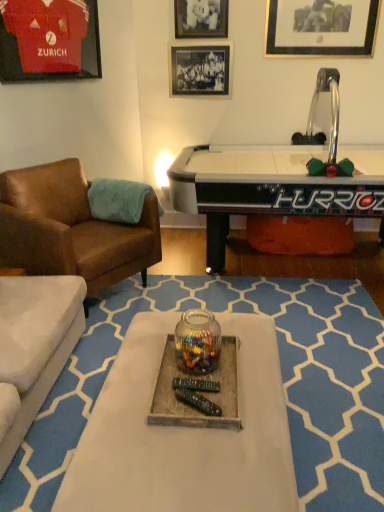
What is the approximate width of black matte picture frame at upper center, the first picture frame when ordered from right to left?

The width of black matte picture frame at upper center, the first picture frame when ordered from right to left, is 0.98 inches.

Locate an element on the screen. The height and width of the screenshot is (512, 384). matte jersey at upper left, which appears as the fourth picture frame when viewed from the right is located at coordinates (49, 40).

What do you see at coordinates (49, 40) in the screenshot? This screenshot has height=512, width=384. I see `matte jersey at upper left, placed as the first picture frame when sorted from left to right` at bounding box center [49, 40].

Identify the location of metallic silver picture frame at upper center, acting as the second picture frame starting from the right. This screenshot has width=384, height=512. (201, 18).

This screenshot has height=512, width=384. What are the coordinates of `brown leather chair at left` in the screenshot? It's located at (71, 229).

The image size is (384, 512). What do you see at coordinates (200, 68) in the screenshot?
I see `black matte picture frame at upper center, positioned as the 3th picture frame in right-to-left order` at bounding box center [200, 68].

What are the coordinates of `black plastic remote control at center, which is the first remote control in front-to-back order` in the screenshot? It's located at (197, 401).

Considering the relative sizes of metallic silver picture frame at upper center, positioned as the third picture frame in left-to-right order, and brown leather chair at left in the image provided, is metallic silver picture frame at upper center, positioned as the third picture frame in left-to-right order, wider than brown leather chair at left?

In fact, metallic silver picture frame at upper center, positioned as the third picture frame in left-to-right order, might be narrower than brown leather chair at left.

Could you tell me if metallic silver picture frame at upper center, positioned as the third picture frame in left-to-right order, is turned towards brown leather chair at left?

No, metallic silver picture frame at upper center, positioned as the third picture frame in left-to-right order, is not facing towards brown leather chair at left.

Is metallic silver picture frame at upper center, positioned as the third picture frame in left-to-right order, further to the viewer compared to brown leather chair at left?

Yes, it is behind brown leather chair at left.

Is white glossy air hockey table at center, arranged as the first table when viewed from the top, with matte jersey at upper left, which appears as the fourth picture frame when viewed from the right?

No, white glossy air hockey table at center, arranged as the first table when viewed from the top, is not in contact with matte jersey at upper left, which appears as the fourth picture frame when viewed from the right.

From the image's perspective, which object appears higher, white glossy air hockey table at center, arranged as the first table when viewed from the top, or matte jersey at upper left, which appears as the fourth picture frame when viewed from the right?

matte jersey at upper left, which appears as the fourth picture frame when viewed from the right, from the image's perspective.

Does white glossy air hockey table at center, the second table in the bottom-to-top sequence, lie behind matte jersey at upper left, placed as the first picture frame when sorted from left to right?

No.

Does point (297, 201) lie behind point (316, 53)?

That is False.

Which of these two, white glossy air hockey table at center, arranged as the first table when viewed from the top, or black matte picture frame at upper center, the first picture frame when ordered from right to left, is thinner?

With smaller width is black matte picture frame at upper center, the first picture frame when ordered from right to left.

In terms of size, does white glossy air hockey table at center, the second table in the bottom-to-top sequence, appear bigger or smaller than black matte picture frame at upper center, the first picture frame when ordered from right to left?

Considering their sizes, white glossy air hockey table at center, the second table in the bottom-to-top sequence, takes up more space than black matte picture frame at upper center, the first picture frame when ordered from right to left.

Considering the relative sizes of white glossy air hockey table at center, the second table in the bottom-to-top sequence, and black matte picture frame at upper center, the first picture frame when ordered from right to left, in the image provided, is white glossy air hockey table at center, the second table in the bottom-to-top sequence, shorter than black matte picture frame at upper center, the first picture frame when ordered from right to left,?

Incorrect, the height of white glossy air hockey table at center, the second table in the bottom-to-top sequence, does not fall short of that of black matte picture frame at upper center, the first picture frame when ordered from right to left.

Who is bigger, white wood tray at center, which ranks as the 1th table in bottom-to-top order, or matte jersey at upper left, which appears as the fourth picture frame when viewed from the right?

Bigger between the two is white wood tray at center, which ranks as the 1th table in bottom-to-top order.

Is white wood tray at center, which ranks as the 1th table in bottom-to-top order, positioned with its back to matte jersey at upper left, placed as the first picture frame when sorted from left to right?

No.

Is point (80, 495) farther from camera compared to point (2, 77)?

No, it is in front of (2, 77).

From a real-world perspective, is white wood tray at center, which is the second table in top-to-bottom order, above or below matte jersey at upper left, which appears as the fourth picture frame when viewed from the right?

Clearly, from a real-world perspective, white wood tray at center, which is the second table in top-to-bottom order, is below matte jersey at upper left, which appears as the fourth picture frame when viewed from the right.

Is black plastic remote control at center, arranged as the second remote control when viewed from the back, touching black matte picture frame at upper center, the first picture frame when ordered from right to left?

No, black plastic remote control at center, arranged as the second remote control when viewed from the back, is not with black matte picture frame at upper center, the first picture frame when ordered from right to left.

Is black plastic remote control at center, which is the first remote control in front-to-back order, looking in the opposite direction of black matte picture frame at upper center, which appears as the 4th picture frame when viewed from the left?

No, black plastic remote control at center, which is the first remote control in front-to-back order, is not facing away from black matte picture frame at upper center, which appears as the 4th picture frame when viewed from the left.

Does black plastic remote control at center, which is the first remote control in front-to-back order, appear on the right side of black matte picture frame at upper center, the first picture frame when ordered from right to left?

In fact, black plastic remote control at center, which is the first remote control in front-to-back order, is to the left of black matte picture frame at upper center, the first picture frame when ordered from right to left.

Is black matte picture frame at upper center, positioned as the 3th picture frame in right-to-left order, further to camera compared to black matte picture frame at upper center, which appears as the 4th picture frame when viewed from the left?

That is True.

Where is `picture frame that is the 2nd one when counting backward from the black matte picture frame at upper center, which appears as the 4th picture frame when viewed from the left`? The image size is (384, 512). picture frame that is the 2nd one when counting backward from the black matte picture frame at upper center, which appears as the 4th picture frame when viewed from the left is located at coordinates (200, 68).

From a real-world perspective, is black matte picture frame at upper center, positioned as the 2th picture frame in left-to-right order, below black matte picture frame at upper center, which appears as the 4th picture frame when viewed from the left?

Correct, in the physical world, black matte picture frame at upper center, positioned as the 2th picture frame in left-to-right order, is lower than black matte picture frame at upper center, which appears as the 4th picture frame when viewed from the left.

Is black matte picture frame at upper center, positioned as the 2th picture frame in left-to-right order, aimed at black matte picture frame at upper center, the first picture frame when ordered from right to left?

No, black matte picture frame at upper center, positioned as the 2th picture frame in left-to-right order, is not turned towards black matte picture frame at upper center, the first picture frame when ordered from right to left.

Does point (185, 74) come in front of point (190, 500)?

No, it is behind (190, 500).

From a real-world perspective, is black matte picture frame at upper center, positioned as the 2th picture frame in left-to-right order, below white wood tray at center, which ranks as the 1th table in bottom-to-top order?

Incorrect, from a real-world perspective, black matte picture frame at upper center, positioned as the 2th picture frame in left-to-right order, is higher than white wood tray at center, which ranks as the 1th table in bottom-to-top order.

Is black matte picture frame at upper center, positioned as the 2th picture frame in left-to-right order, wider than white wood tray at center, which is the second table in top-to-bottom order?

Incorrect, the width of black matte picture frame at upper center, positioned as the 2th picture frame in left-to-right order, does not surpass that of white wood tray at center, which is the second table in top-to-bottom order.

The width and height of the screenshot is (384, 512). What are the coordinates of `picture frame that is the 2nd object to the right of the brown leather chair at left, starting at the anchor` in the screenshot? It's located at (201, 18).

Which picture frame is the 3rd one when counting from the left side of the white glossy air hockey table at center, the second table in the bottom-to-top sequence? Please provide its 2D coordinates.

[(49, 40)]

Based on their spatial positions, is black matte picture frame at upper center, positioned as the 3th picture frame in right-to-left order, or black plastic remote control at center, which is counted as the 2th remote control, starting from the front, further from metallic silver picture frame at upper center, acting as the second picture frame starting from the right?

Among the two, black plastic remote control at center, which is counted as the 2th remote control, starting from the front, is located further to metallic silver picture frame at upper center, acting as the second picture frame starting from the right.

Looking at the image, which one is located closer to translucent glass jar at center, black matte picture frame at upper center, positioned as the 2th picture frame in left-to-right order, or black plastic remote control at center, arranged as the second remote control when viewed from the back?

Based on the image, black plastic remote control at center, arranged as the second remote control when viewed from the back, appears to be nearer to translucent glass jar at center.

Consider the image. When comparing their distances from brown leather chair at left, does black plastic remote control at center, which is the first remote control in front-to-back order, or matte jersey at upper left, placed as the first picture frame when sorted from left to right, seem closer?

Among the two, matte jersey at upper left, placed as the first picture frame when sorted from left to right, is located nearer to brown leather chair at left.

Consider the image. Looking at the image, which one is located closer to white glossy air hockey table at center, arranged as the first table when viewed from the top, matte jersey at upper left, placed as the first picture frame when sorted from left to right, or black matte picture frame at upper center, positioned as the 2th picture frame in left-to-right order?

black matte picture frame at upper center, positioned as the 2th picture frame in left-to-right order, is positioned closer to the anchor white glossy air hockey table at center, arranged as the first table when viewed from the top.

Based on their spatial positions, is black plastic remote control at center, arranged as the second remote control when viewed from the back, or white wood tray at center, which is the second table in top-to-bottom order, further from translucent glass jar at center?

The object further to translucent glass jar at center is black plastic remote control at center, arranged as the second remote control when viewed from the back.

Which object lies nearer to the anchor point translucent glass jar at center, black plastic remote control at center, which is counted as the 2th remote control, starting from the front, or white glossy air hockey table at center, the second table in the bottom-to-top sequence?

The object closer to translucent glass jar at center is black plastic remote control at center, which is counted as the 2th remote control, starting from the front.

Considering their positions, is black plastic remote control at center, which is the first remote control in front-to-back order, positioned further to black matte picture frame at upper center, the first picture frame when ordered from right to left, than matte jersey at upper left, placed as the first picture frame when sorted from left to right?

black plastic remote control at center, which is the first remote control in front-to-back order.

Looking at the image, which one is located further to black matte picture frame at upper center, positioned as the 3th picture frame in right-to-left order, black plastic remote control at center, the 1th remote control from the back, or matte jersey at upper left, placed as the first picture frame when sorted from left to right?

Among the two, black plastic remote control at center, the 1th remote control from the back, is located further to black matte picture frame at upper center, positioned as the 3th picture frame in right-to-left order.

What are the coordinates of `glass vase between white glossy air hockey table at center, arranged as the first table when viewed from the top, and white wood tray at center, which ranks as the 1th table in bottom-to-top order, in the vertical direction` in the screenshot? It's located at (197, 342).

Find the location of `glass vase between matte jersey at upper left, placed as the first picture frame when sorted from left to right, and black plastic remote control at center, arranged as the second remote control when viewed from the back, in the up-down direction`. glass vase between matte jersey at upper left, placed as the first picture frame when sorted from left to right, and black plastic remote control at center, arranged as the second remote control when viewed from the back, in the up-down direction is located at coordinates (197, 342).

Identify the location of glass vase located between brown leather chair at left and white glossy air hockey table at center, arranged as the first table when viewed from the top, in the left-right direction. (197, 342).

Identify the location of remote control between white glossy air hockey table at center, arranged as the first table when viewed from the top, and black plastic remote control at center, arranged as the second remote control when viewed from the back, in the vertical direction. This screenshot has height=512, width=384. (196, 385).